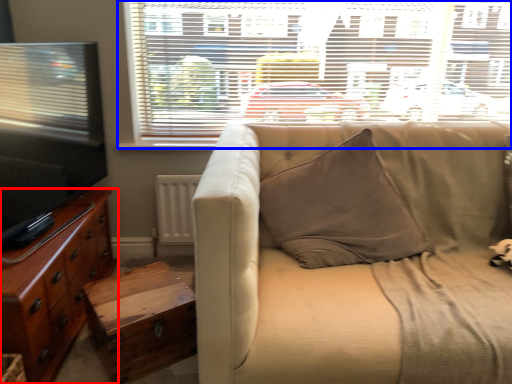
Question: Which of the following is the farthest to the observer, cabinetry (highlighted by a red box) or window (highlighted by a blue box)?

Choices:
 (A) cabinetry
 (B) window

Answer: (B)